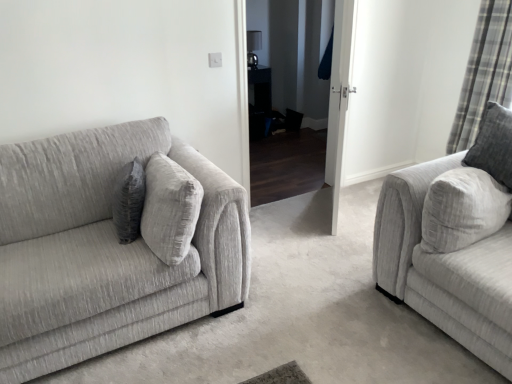
Question: From the image's perspective, is textured gray couch at left, placed as the second studio couch when sorted from right to left, over white glossy door at center?

Choices:
 (A) no
 (B) yes

Answer: (A)

Question: From a real-world perspective, is textured gray couch at left, placed as the second studio couch when sorted from right to left, beneath white glossy door at center?

Choices:
 (A) yes
 (B) no

Answer: (A)

Question: Can you confirm if textured gray couch at left, arranged as the 1th studio couch when viewed from the left, is wider than white glossy door at center?

Choices:
 (A) yes
 (B) no

Answer: (A)

Question: Considering the relative sizes of textured gray couch at left, placed as the second studio couch when sorted from right to left, and white glossy door at center in the image provided, is textured gray couch at left, placed as the second studio couch when sorted from right to left, smaller than white glossy door at center?

Choices:
 (A) no
 (B) yes

Answer: (A)

Question: Considering the positions of gray fabric pillow at center and textured gray couch at right, which is the 1th studio couch in right-to-left order, in the image, is gray fabric pillow at center bigger or smaller than textured gray couch at right, which is the 1th studio couch in right-to-left order,?

Choices:
 (A) small
 (B) big

Answer: (A)

Question: Is gray fabric pillow at center inside the boundaries of textured gray couch at right, positioned as the 2th studio couch in left-to-right order, or outside?

Choices:
 (A) outside
 (B) inside

Answer: (A)

Question: Visually, is gray fabric pillow at center positioned to the left or to the right of textured gray couch at right, which is the 1th studio couch in right-to-left order?

Choices:
 (A) left
 (B) right

Answer: (A)

Question: Is point (124, 221) closer or farther from the camera than point (454, 251)?

Choices:
 (A) farther
 (B) closer

Answer: (A)

Question: Choose the correct answer: Is textured gray couch at right, which is the 1th studio couch in right-to-left order, inside plaid fabric curtain at right or outside it?

Choices:
 (A) outside
 (B) inside

Answer: (A)

Question: In the image, is textured gray couch at right, which is the 1th studio couch in right-to-left order, positioned in front of or behind plaid fabric curtain at right?

Choices:
 (A) front
 (B) behind

Answer: (A)

Question: Is textured gray couch at right, which is the 1th studio couch in right-to-left order, taller or shorter than plaid fabric curtain at right?

Choices:
 (A) tall
 (B) short

Answer: (B)

Question: Based on their positions, is textured gray couch at right, positioned as the 2th studio couch in left-to-right order, located to the left or right of plaid fabric curtain at right?

Choices:
 (A) left
 (B) right

Answer: (A)

Question: In terms of width, does plaid fabric curtain at right look wider or thinner when compared to textured gray couch at right, which is the 1th studio couch in right-to-left order?

Choices:
 (A) thin
 (B) wide

Answer: (A)

Question: Does point (503, 43) appear closer or farther from the camera than point (454, 238)?

Choices:
 (A) farther
 (B) closer

Answer: (A)